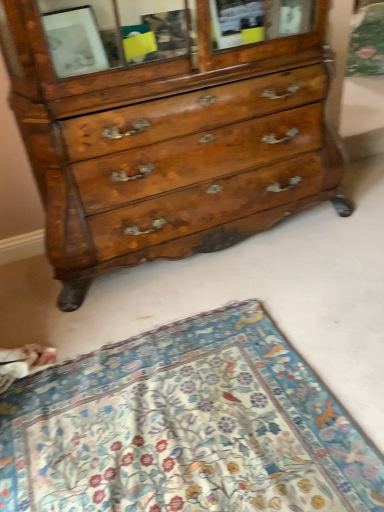
Question: Is point (201, 499) closer or farther from the camera than point (64, 263)?

Choices:
 (A) farther
 (B) closer

Answer: (B)

Question: Is floral-patterned fabric at lower center wider or thinner than shiny brown wood chest of drawers at center?

Choices:
 (A) thin
 (B) wide

Answer: (B)

Question: Considering their positions, is floral-patterned fabric at lower center located in front of or behind shiny brown wood chest of drawers at center?

Choices:
 (A) front
 (B) behind

Answer: (A)

Question: Is point (215, 6) positioned closer to the camera than point (69, 391)?

Choices:
 (A) closer
 (B) farther

Answer: (B)

Question: Looking at the image, does shiny brown wood chest of drawers at center seem bigger or smaller compared to floral-patterned fabric at lower center?

Choices:
 (A) big
 (B) small

Answer: (A)

Question: Looking at their shapes, would you say shiny brown wood chest of drawers at center is wider or thinner than floral-patterned fabric at lower center?

Choices:
 (A) thin
 (B) wide

Answer: (A)

Question: From the image's perspective, is shiny brown wood chest of drawers at center above or below floral-patterned fabric at lower center?

Choices:
 (A) below
 (B) above

Answer: (B)